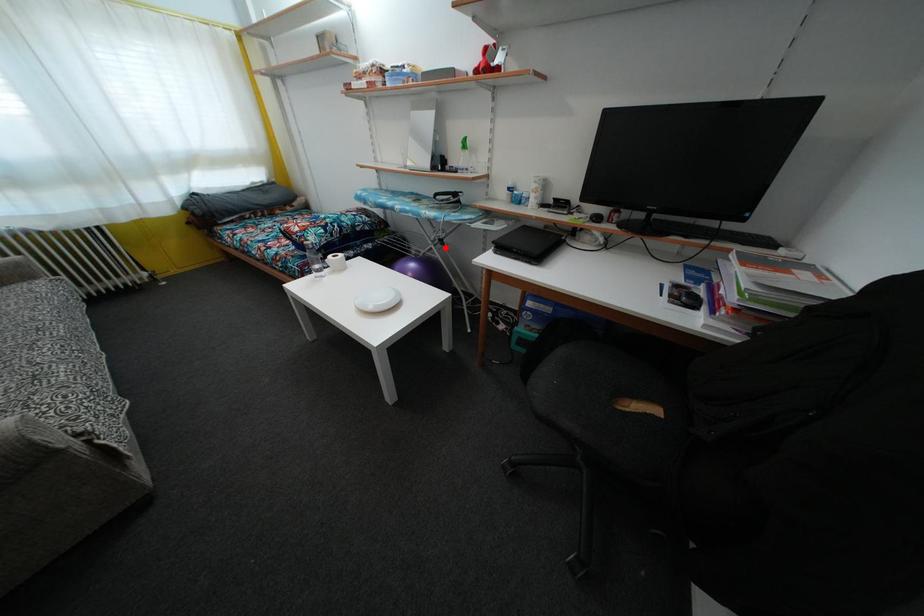
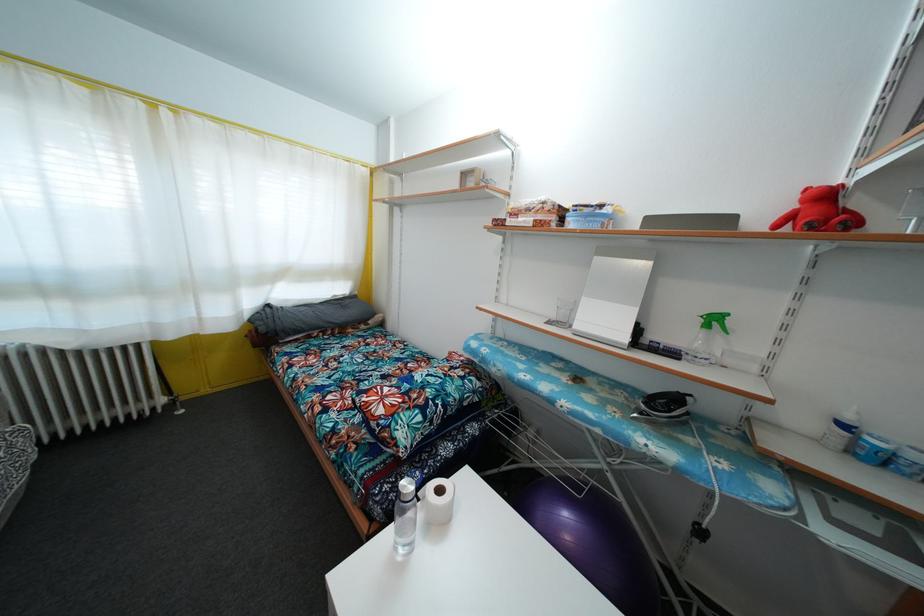
Question: I am providing you with two images of the same scene from different viewpoints. Given a red point in image1, look at the same physical point in image2. Is it:

Choices:
 (A) Closer to the viewpoint
 (B) Farther from the viewpoint

Answer: (B)